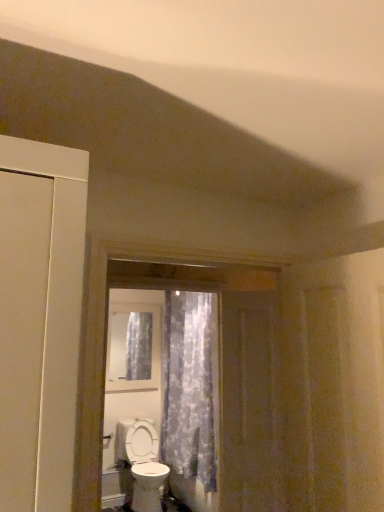
Question: Can you confirm if clear glass window at center is shorter than brown wooden screen door at center?

Choices:
 (A) no
 (B) yes

Answer: (B)

Question: Is the surface of clear glass window at center in direct contact with brown wooden screen door at center?

Choices:
 (A) no
 (B) yes

Answer: (A)

Question: Is clear glass window at center closer to the viewer compared to brown wooden screen door at center?

Choices:
 (A) no
 (B) yes

Answer: (A)

Question: From a real-world perspective, is clear glass window at center located higher than brown wooden screen door at center?

Choices:
 (A) yes
 (B) no

Answer: (A)

Question: From the image's perspective, is clear glass window at center under brown wooden screen door at center?

Choices:
 (A) no
 (B) yes

Answer: (B)

Question: Does clear glass window at center appear on the right side of brown wooden screen door at center?

Choices:
 (A) no
 (B) yes

Answer: (A)

Question: Is translucent floral fabric at center aimed at brown wooden screen door at center?

Choices:
 (A) no
 (B) yes

Answer: (A)

Question: Is translucent floral fabric at center positioned beyond the bounds of brown wooden screen door at center?

Choices:
 (A) yes
 (B) no

Answer: (A)

Question: From the image's perspective, would you say translucent floral fabric at center is positioned over brown wooden screen door at center?

Choices:
 (A) yes
 (B) no

Answer: (B)

Question: Can you confirm if translucent floral fabric at center is thinner than brown wooden screen door at center?

Choices:
 (A) yes
 (B) no

Answer: (B)

Question: Is brown wooden screen door at center completely or partially inside translucent floral fabric at center?

Choices:
 (A) no
 (B) yes

Answer: (A)

Question: Is translucent floral fabric at center next to brown wooden screen door at center?

Choices:
 (A) yes
 (B) no

Answer: (B)

Question: Is brown wooden screen door at center closer to the viewer compared to clear glass window at center?

Choices:
 (A) yes
 (B) no

Answer: (A)